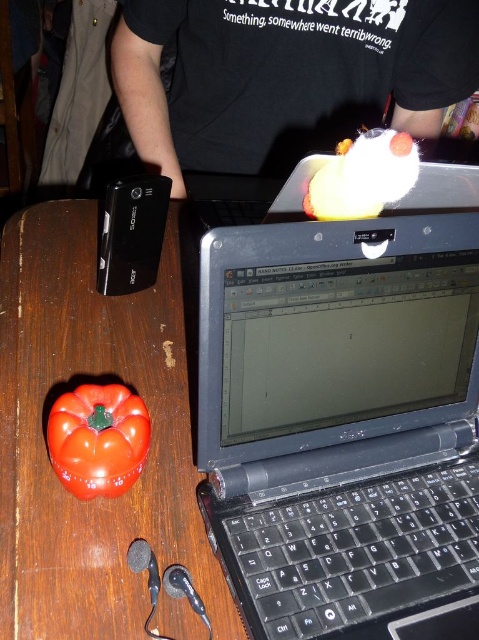
Can you confirm if shiny plastic bell pepper at lower left is positioned to the right of white fluffy cloud at upper center?

In fact, shiny plastic bell pepper at lower left is to the left of white fluffy cloud at upper center.

Does shiny plastic bell pepper at lower left have a greater height compared to white fluffy cloud at upper center?

Yes.

At what (x,y) coordinates should I click in order to perform the action: click on shiny plastic bell pepper at lower left. Please return your answer as a coordinate pair (x, y). This screenshot has height=640, width=479. Looking at the image, I should click on (98, 440).

Which is below, black cotton shirt at upper center or shiny plastic bell pepper at lower left?

Positioned lower is shiny plastic bell pepper at lower left.

Is black cotton shirt at upper center smaller than shiny plastic bell pepper at lower left?

No, black cotton shirt at upper center is not smaller than shiny plastic bell pepper at lower left.

Who is more forward, (476, 12) or (121, 451)?

Point (121, 451) is in front.

Locate an element on the screen. black cotton shirt at upper center is located at coordinates (285, 74).

Which is behind, point (296, 372) or point (387, 173)?

The point (296, 372) is behind.

Which is in front, point (456, 292) or point (365, 200)?

Point (365, 200) is more forward.

Between point (242, 532) and point (371, 177), which one is positioned in front?

Point (242, 532) is more forward.

Where is `black plastic laptop at upper center`? The height and width of the screenshot is (640, 479). black plastic laptop at upper center is located at coordinates (341, 420).